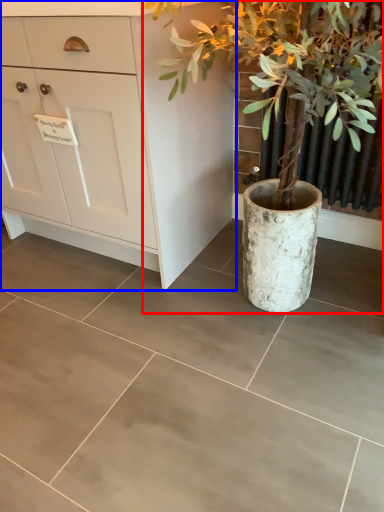
Question: Which point is closer to the camera, houseplant (highlighted by a red box) or chest of drawers (highlighted by a blue box)?

Choices:
 (A) houseplant
 (B) chest of drawers

Answer: (A)